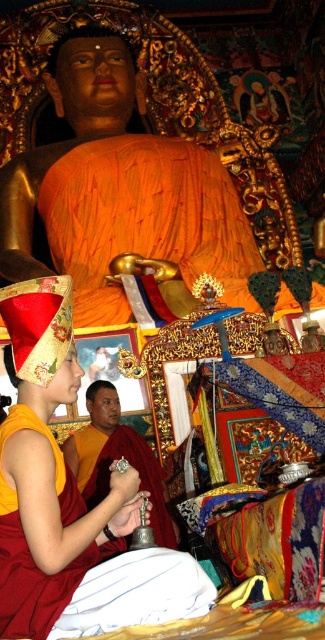
You are a visitor standing at the entrance of the temple. You see the maroon silk robe at lower left and the smooth gold bell at center. Which object is closer to you?

The maroon silk robe at lower left is closer to you because it is in front of the smooth gold bell at center.

You are a visitor in this temple and want to take a photo of the smooth gold bell at center without any obstruction. Is the maroon silk robe at lower left blocking your view of the bell?

The maroon silk robe at lower left is below the smooth gold bell at center, so it is not blocking the view of the bell from your perspective.

You are a visitor standing at the entrance of the temple and see the maroon silk robe at lower left and the smooth gold bell at center. The temple has a strict rule that you must stay at least 40 feet away from any sacred objects. Are you currently violating this rule?

The maroon silk robe at lower left is 42.11 feet away from smooth gold bell at center. Since the minimum distance required is 40 feet, you are not violating the rule as you are 2.11 feet beyond the required distance.